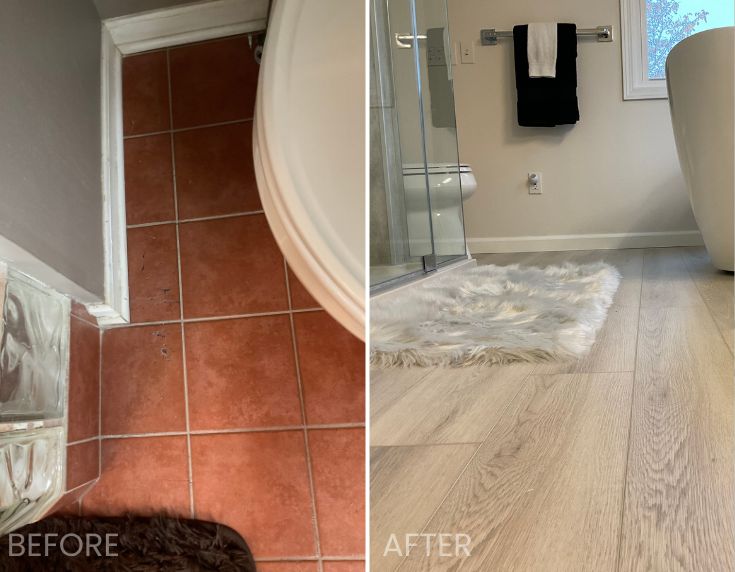
You are a GUI agent. You are given a task and a screenshot of the screen. Output one action in this format:
    pyautogui.click(x=<x>, y=<y>)
    Task: Click on the floor tile
    
    Given the screenshot: What is the action you would take?
    pos(265,363), pos(259,480), pos(218,274), pos(153,466)